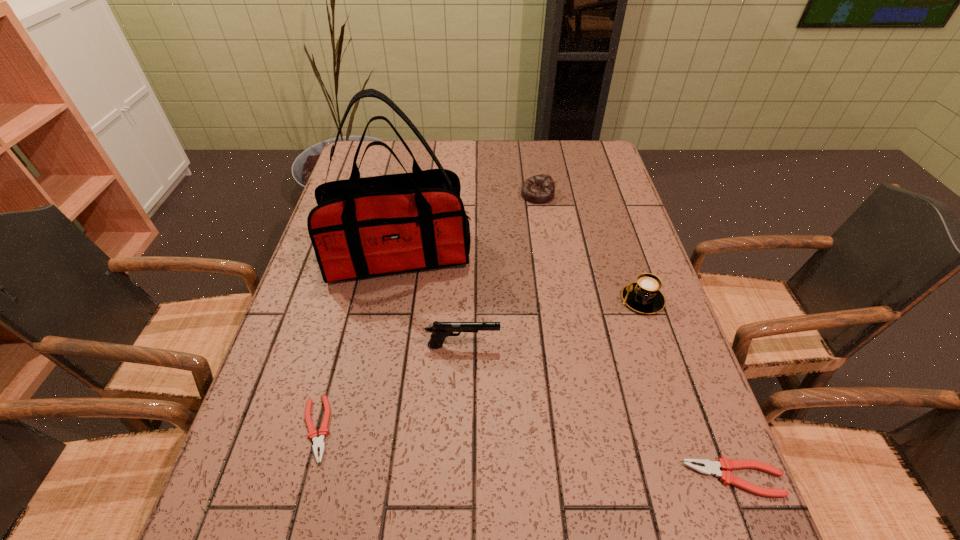
You are a GUI agent. You are given a task and a screenshot of the screen. Output one action in this format:
    pyautogui.click(x=<x>, y=<y>)
    Task: Click on the shortest object
    This screenshot has height=540, width=960.
    Given the screenshot: What is the action you would take?
    pyautogui.click(x=318, y=442)

Locate an element on the screen. The height and width of the screenshot is (540, 960). the shorter pliers is located at coordinates (318, 442).

Where is `the taller pliers`? the taller pliers is located at coordinates (710, 467).

You are a GUI agent. You are given a task and a screenshot of the screen. Output one action in this format:
    pyautogui.click(x=<x>, y=<y>)
    Task: Click on the right pliers
    The image size is (960, 540).
    Given the screenshot: What is the action you would take?
    710,467

This screenshot has width=960, height=540. Identify the location of the fourth object from left to right. (540, 188).

The width and height of the screenshot is (960, 540). In order to click on the farthest object in this screenshot , I will do `click(540, 188)`.

Where is `gun`? The image size is (960, 540). gun is located at coordinates (440, 330).

Where is `the fourth farthest object`? The width and height of the screenshot is (960, 540). the fourth farthest object is located at coordinates (440, 330).

Find the location of a particular element. This screenshot has height=540, width=960. cappuccino is located at coordinates (644, 296).

Find the location of a particular element. duffel bag is located at coordinates pyautogui.click(x=366, y=227).